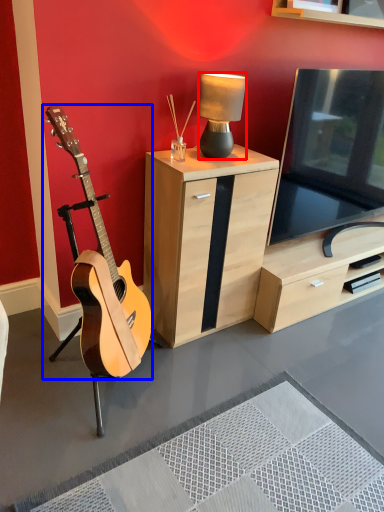
Question: Among these objects, which one is farthest to the camera, lamp (highlighted by a red box) or guitar (highlighted by a blue box)?

Choices:
 (A) lamp
 (B) guitar

Answer: (A)